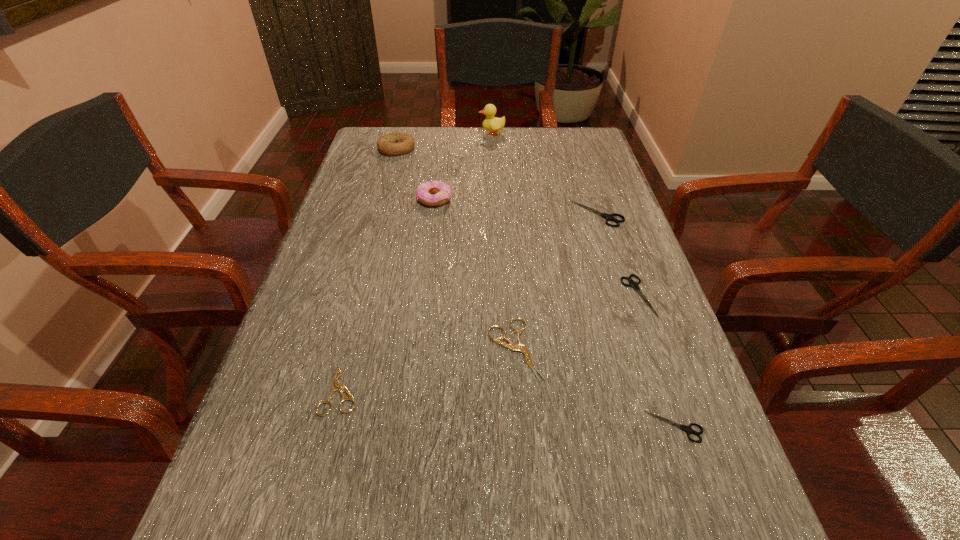
Identify the location of free point located on the left of the tallest shears. The width and height of the screenshot is (960, 540). (507, 213).

Find the location of a particular element. vacant space situated 0.080m on the left of the second smallest black shears is located at coordinates (587, 295).

The image size is (960, 540). What are the coordinates of `vacant region located 0.070m on the front of the fourth shears from right to left` in the screenshot? It's located at (519, 421).

Where is `free space located on the back of the smaller beige shears`? The width and height of the screenshot is (960, 540). free space located on the back of the smaller beige shears is located at coordinates (380, 237).

The height and width of the screenshot is (540, 960). What are the coordinates of `vacant region located 0.110m on the left of the smallest black shears` in the screenshot? It's located at (581, 427).

At what (x,y) coordinates should I click in order to perform the action: click on duckling positioned at the far edge. Please return your answer as a coordinate pair (x, y). Looking at the image, I should click on (493, 124).

Locate an element on the screen. The width and height of the screenshot is (960, 540). bagel that is positioned at the far edge is located at coordinates (392, 144).

Locate an element on the screen. The width and height of the screenshot is (960, 540). bagel that is at the left edge is located at coordinates (392, 144).

At what (x,y) coordinates should I click in order to perform the action: click on shears that is at the left edge. Please return your answer as a coordinate pair (x, y). The height and width of the screenshot is (540, 960). Looking at the image, I should click on (336, 385).

Find the location of a particular element. The image size is (960, 540). object that is positioned at the far left corner is located at coordinates (392, 144).